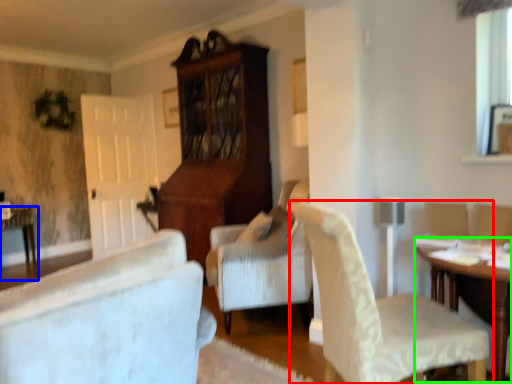
Question: Which object is positioned farthest from chair (highlighted by a red box)? Select from table (highlighted by a blue box) and table (highlighted by a green box).

Choices:
 (A) table
 (B) table

Answer: (A)